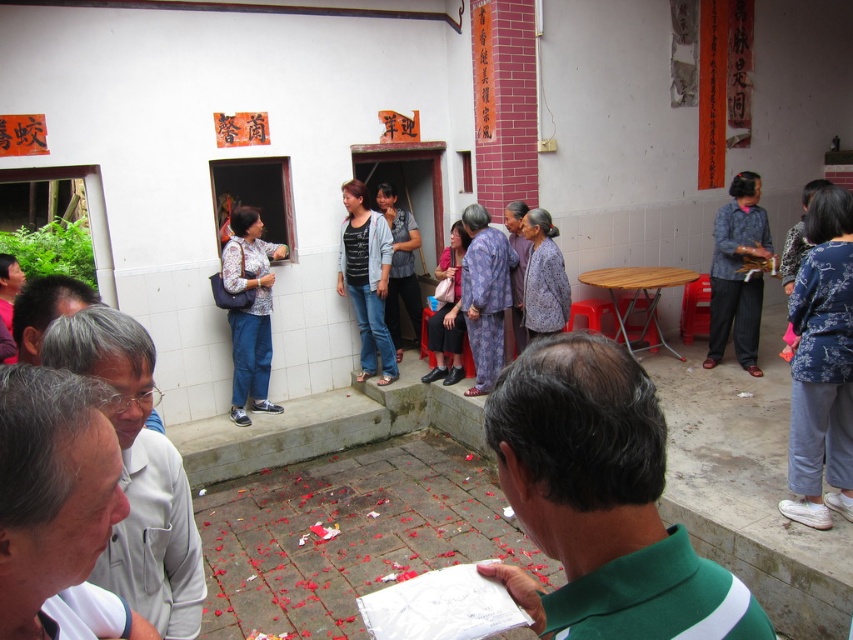
Question: Among these objects, which one is farthest from the camera?

Choices:
 (A) white matte shirt at lower left
 (B) printed fabric blouse at center
 (C) red plastic stool at center
 (D) matte gray shirt at center

Answer: (D)

Question: Which of the following is the farthest from the observer?

Choices:
 (A) gray matte glasses at lower left
 (B) printed fabric blouse at center
 (C) matte gray shirt at center

Answer: (C)

Question: Can you confirm if blue textured blouse at right is smaller than gray matte glasses at lower left?

Choices:
 (A) no
 (B) yes

Answer: (A)

Question: Observing the image, what is the correct spatial positioning of purple printed dress at center in reference to purple textured jacket at center?

Choices:
 (A) below
 (B) above

Answer: (A)

Question: Among these objects, which one is nearest to the camera?

Choices:
 (A) purple printed dress at center
 (B) gray matte glasses at lower left

Answer: (B)

Question: Observing the image, what is the correct spatial positioning of purple textured jacket at center in reference to red plastic stool at center?

Choices:
 (A) left
 (B) right

Answer: (A)